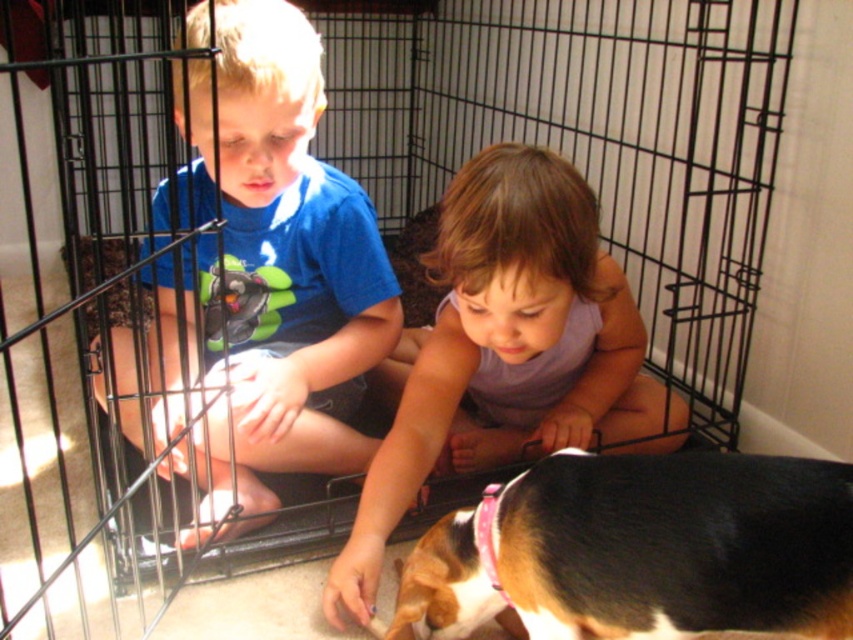
Question: Considering the real-world distances, which object is farthest from the blue cotton shirt at left?

Choices:
 (A) pastel purple fabric at center
 (B) black and white fur at lower right

Answer: (B)

Question: Can you confirm if black and white fur at lower right is thinner than pastel purple fabric at center?

Choices:
 (A) no
 (B) yes

Answer: (B)

Question: Which object is the farthest from the black and white fur at lower right?

Choices:
 (A) pastel purple fabric at center
 (B) blue cotton shirt at left

Answer: (B)

Question: Which object is closer to the camera taking this photo?

Choices:
 (A) black and white fur at lower right
 (B) pastel purple fabric at center
 (C) blue cotton shirt at left

Answer: (A)

Question: Is blue cotton shirt at left in front of pastel purple fabric at center?

Choices:
 (A) yes
 (B) no

Answer: (A)

Question: Is blue cotton shirt at left wider than black and white fur at lower right?

Choices:
 (A) yes
 (B) no

Answer: (A)